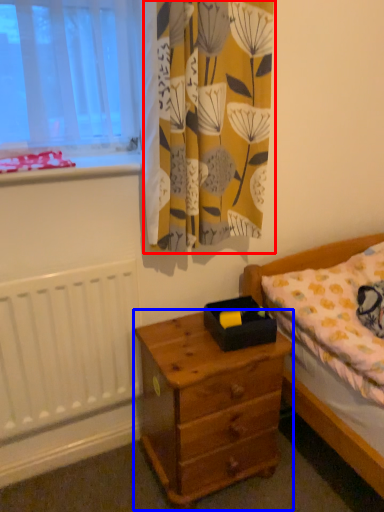
Question: Which object appears farthest to the camera in this image, curtain (highlighted by a red box) or nightstand (highlighted by a blue box)?

Choices:
 (A) curtain
 (B) nightstand

Answer: (B)